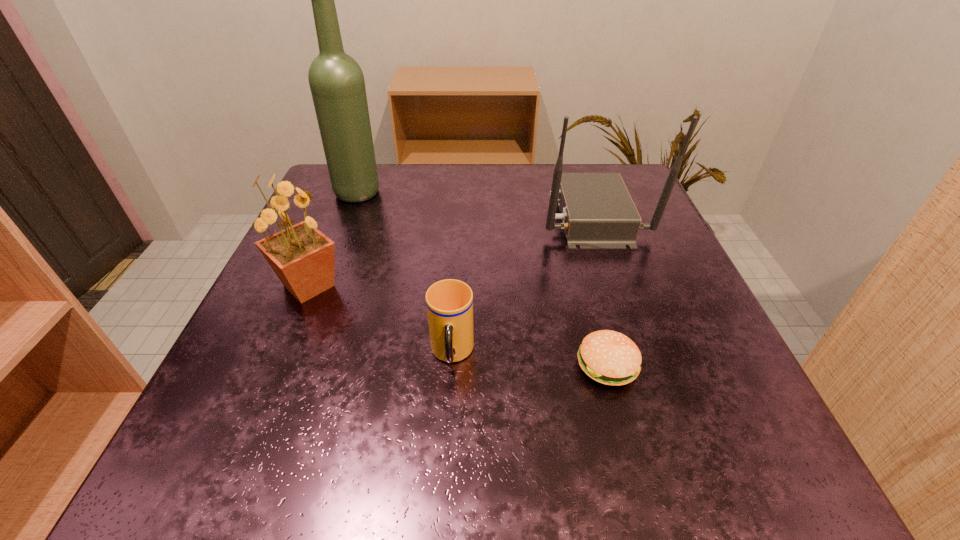
Where is `free spot that satisfies the following two spatial constraints: 1. at the front of the patty with flowers visible; 2. on the right side of the sunflower`? The width and height of the screenshot is (960, 540). free spot that satisfies the following two spatial constraints: 1. at the front of the patty with flowers visible; 2. on the right side of the sunflower is located at coordinates (276, 365).

This screenshot has height=540, width=960. What are the coordinates of `free space that satisfies the following two spatial constraints: 1. at the front of the sunflower with flowers visible; 2. on the back side of the shortest object` in the screenshot? It's located at (276, 365).

Where is `vacant space that satisfies the following two spatial constraints: 1. at the front of the third nearest object with flowers visible; 2. on the left side of the shortest object`? Image resolution: width=960 pixels, height=540 pixels. vacant space that satisfies the following two spatial constraints: 1. at the front of the third nearest object with flowers visible; 2. on the left side of the shortest object is located at coordinates (276, 365).